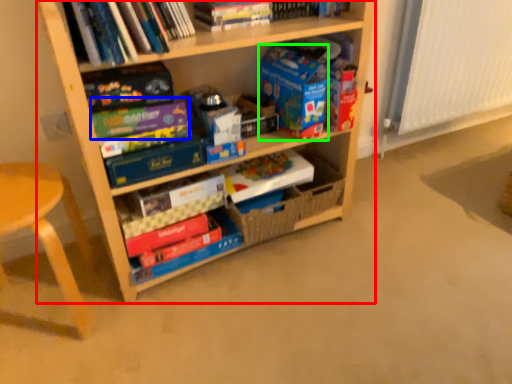
Question: Based on their relative distances, which object is nearer to shelf (highlighted by a red box)? Choose from paperback book (highlighted by a blue box) and paperback book (highlighted by a green box).

Choices:
 (A) paperback book
 (B) paperback book

Answer: (B)